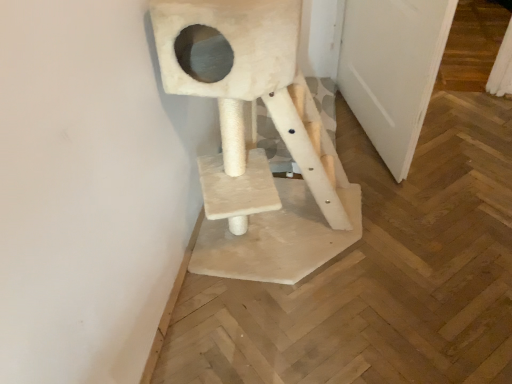
Where is `sanded wood cat tree at center`? sanded wood cat tree at center is located at coordinates (259, 148).

Image resolution: width=512 pixels, height=384 pixels. What do you see at coordinates (259, 148) in the screenshot?
I see `sanded wood cat tree at center` at bounding box center [259, 148].

The image size is (512, 384). Identify the location of white matte door at right. (392, 70).

The image size is (512, 384). What do you see at coordinates (392, 70) in the screenshot? I see `white matte door at right` at bounding box center [392, 70].

You are a GUI agent. You are given a task and a screenshot of the screen. Output one action in this format:
    pyautogui.click(x=<x>, y=<y>)
    Task: Click on the sanded wood cat tree at center
    The height and width of the screenshot is (384, 512).
    Given the screenshot: What is the action you would take?
    click(259, 148)

Considering the relative positions of sanded wood cat tree at center and white matte door at right in the image provided, is sanded wood cat tree at center to the left or to the right of white matte door at right?

From the image, it's evident that sanded wood cat tree at center is to the left of white matte door at right.

Is sanded wood cat tree at center closer to the viewer compared to white matte door at right?

Yes, it is.

Is point (271, 229) closer or farther from the camera than point (447, 11)?

Point (271, 229) appears to be farther away from the viewer than point (447, 11).

Consider the image. From the image's perspective, is sanded wood cat tree at center located above or below white matte door at right?

From the image's perspective, sanded wood cat tree at center appears below white matte door at right.

From a real-world perspective, is sanded wood cat tree at center on white matte door at right?

Indeed, from a real-world perspective, sanded wood cat tree at center stands above white matte door at right.

Based on the photo, can you confirm if sanded wood cat tree at center is thinner than white matte door at right?

No.

In the scene shown: Considering the relative sizes of sanded wood cat tree at center and white matte door at right in the image provided, is sanded wood cat tree at center shorter than white matte door at right?

Incorrect, the height of sanded wood cat tree at center does not fall short of that of white matte door at right.

Considering the sizes of objects sanded wood cat tree at center and white matte door at right in the image provided, who is bigger, sanded wood cat tree at center or white matte door at right?

With larger size is sanded wood cat tree at center.

Would you say sanded wood cat tree at center is inside or outside white matte door at right?

sanded wood cat tree at center is outside white matte door at right.

Is sanded wood cat tree at center with white matte door at right?

No, sanded wood cat tree at center is not with white matte door at right.

Is sanded wood cat tree at center aimed at white matte door at right?

No, sanded wood cat tree at center is not aimed at white matte door at right.

This screenshot has height=384, width=512. In order to click on door behind the sanded wood cat tree at center in this screenshot , I will do `click(392, 70)`.

Considering the relative positions of white matte door at right and sanded wood cat tree at center in the image provided, is white matte door at right to the left or to the right of sanded wood cat tree at center?

Based on their positions, white matte door at right is located to the right of sanded wood cat tree at center.

Which object is more forward, white matte door at right or sanded wood cat tree at center?

sanded wood cat tree at center is closer to the camera.

Which is less distant, [431,89] or [222,202]?

The point [222,202] is in front.

From the image's perspective, is white matte door at right above or below sanded wood cat tree at center?

Based on their image positions, white matte door at right is located above sanded wood cat tree at center.

From a real-world perspective, is white matte door at right above or below sanded wood cat tree at center?

white matte door at right is situated lower than sanded wood cat tree at center in the real world.

Between white matte door at right and sanded wood cat tree at center, which one has smaller width?

white matte door at right is thinner.

Can you confirm if white matte door at right is shorter than sanded wood cat tree at center?

Indeed, white matte door at right has a lesser height compared to sanded wood cat tree at center.

Who is smaller, white matte door at right or sanded wood cat tree at center?

white matte door at right is smaller.

Is white matte door at right not inside sanded wood cat tree at center?

Yes, white matte door at right is outside of sanded wood cat tree at center.

Are white matte door at right and sanded wood cat tree at center located far from each other?

white matte door at right is actually quite close to sanded wood cat tree at center.

Is white matte door at right facing away from sanded wood cat tree at center?

Yes, sanded wood cat tree at center is at the back of white matte door at right.

The image size is (512, 384). I want to click on door to the right of sanded wood cat tree at center, so click(x=392, y=70).

Locate an element on the screen. door behind the sanded wood cat tree at center is located at coordinates (392, 70).

Find the location of a particular element. sculpture below the white matte door at right (from the image's perspective) is located at coordinates (259, 148).